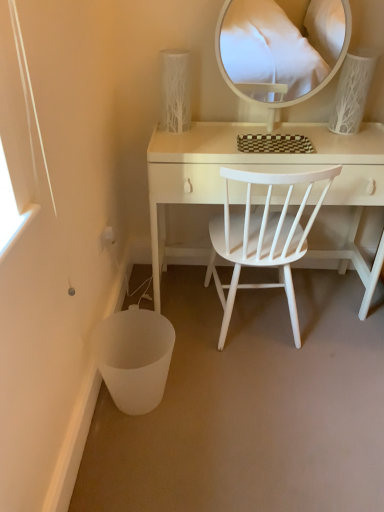
Locate an element on the screen. Image resolution: width=384 pixels, height=512 pixels. free space to the left of white glossy mirror at upper center is located at coordinates (210, 137).